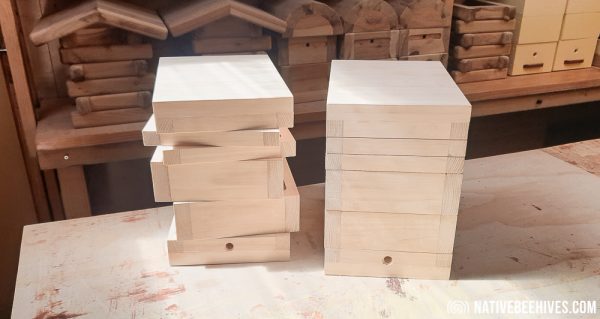
Where is `tablelegs`? This screenshot has width=600, height=319. tablelegs is located at coordinates (75, 184).